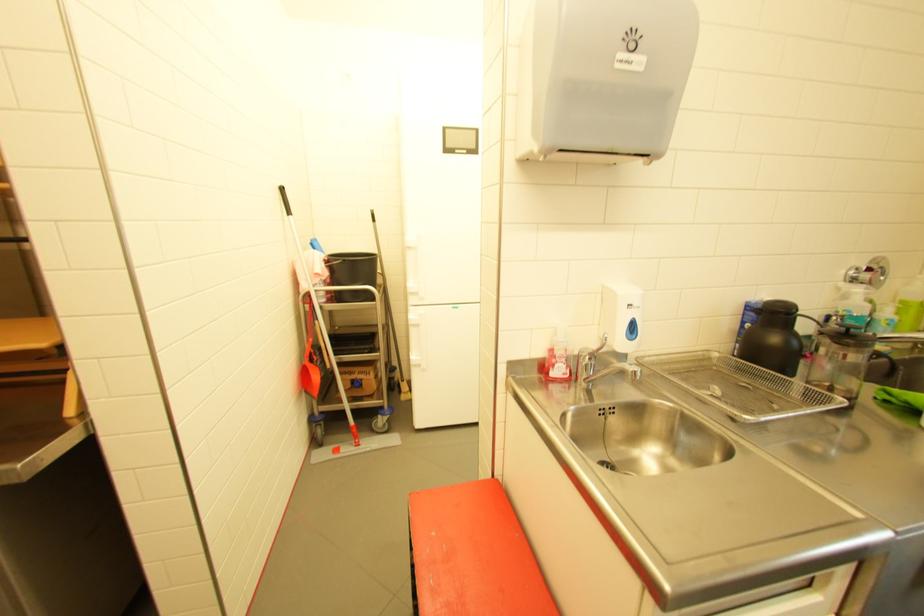
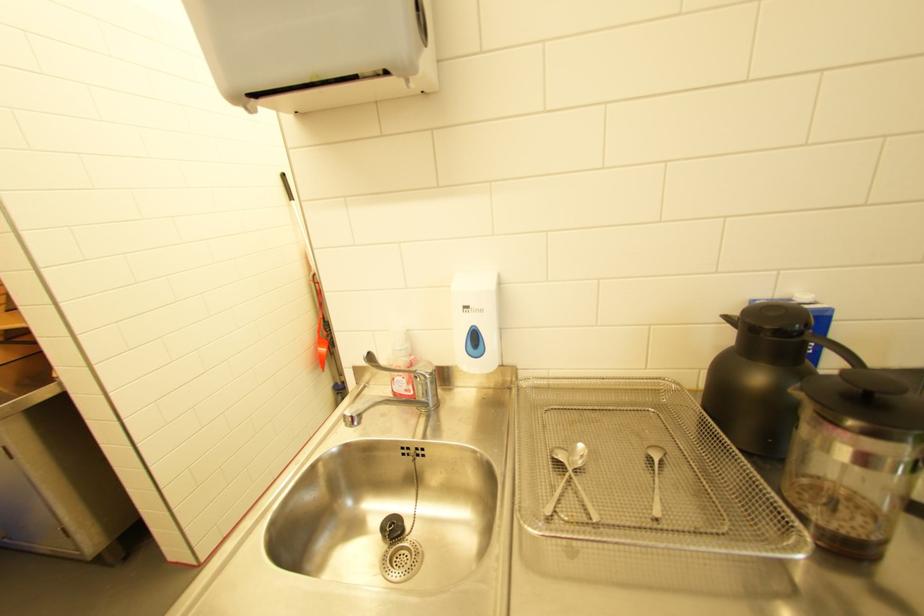
Question: How did the camera likely rotate?

Choices:
 (A) Left
 (B) Right
 (C) Up
 (D) Down

Answer: (A)